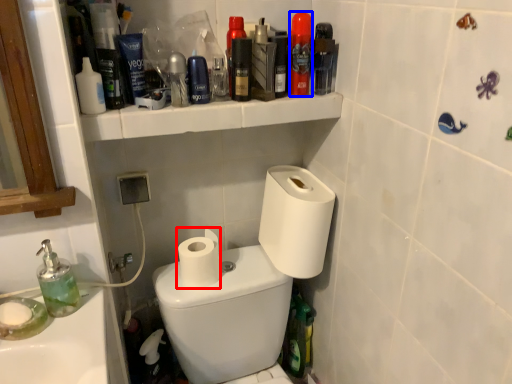
Question: Among these objects, which one is nearest to the camera, toilet paper (highlighted by a red box) or mouthwash (highlighted by a blue box)?

Choices:
 (A) toilet paper
 (B) mouthwash

Answer: (B)